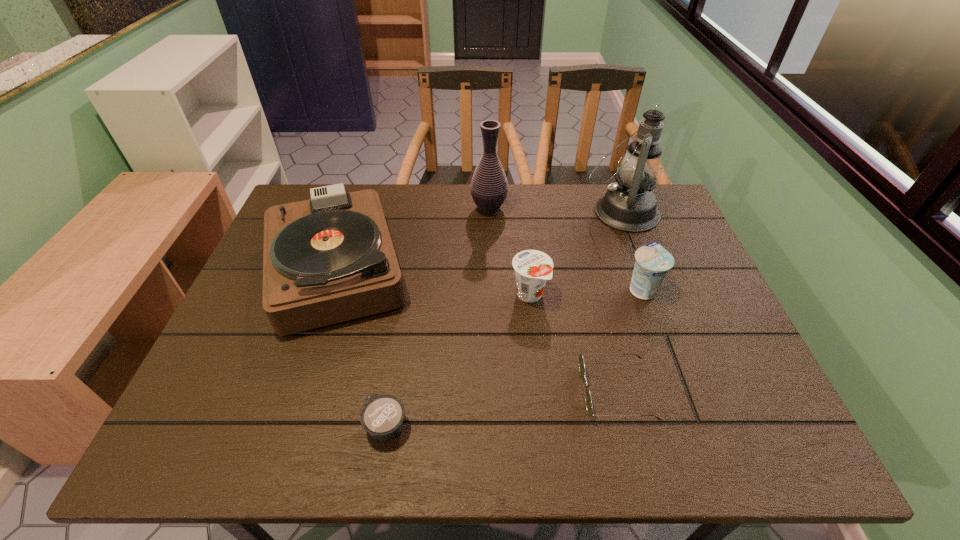
Where is `sunglasses located in the near edge section of the desktop`? The image size is (960, 540). sunglasses located in the near edge section of the desktop is located at coordinates (x=589, y=407).

I want to click on yogurt located at the near edge, so [x=382, y=416].

Where is `object located in the left edge section of the desktop`? The height and width of the screenshot is (540, 960). object located in the left edge section of the desktop is located at coordinates (329, 259).

Where is `oil lamp that is at the right edge`? The height and width of the screenshot is (540, 960). oil lamp that is at the right edge is located at coordinates (629, 205).

You are a GUI agent. You are given a task and a screenshot of the screen. Output one action in this format:
    pyautogui.click(x=<x>, y=<y>)
    Task: Click on the yogurt present at the right edge
    
    Given the screenshot: What is the action you would take?
    pyautogui.click(x=652, y=263)

Where is `object situated at the far left corner`? Image resolution: width=960 pixels, height=540 pixels. object situated at the far left corner is located at coordinates (329, 259).

What are the coordinates of `object located at the far right corner` in the screenshot? It's located at (629, 205).

In order to click on free space at the far edge in this screenshot , I will do `click(407, 197)`.

In order to click on blank space at the right edge of the desktop in this screenshot , I will do (x=682, y=259).

Where is `vacant region between the sunglasses and the tallest object`? The width and height of the screenshot is (960, 540). vacant region between the sunglasses and the tallest object is located at coordinates (619, 301).